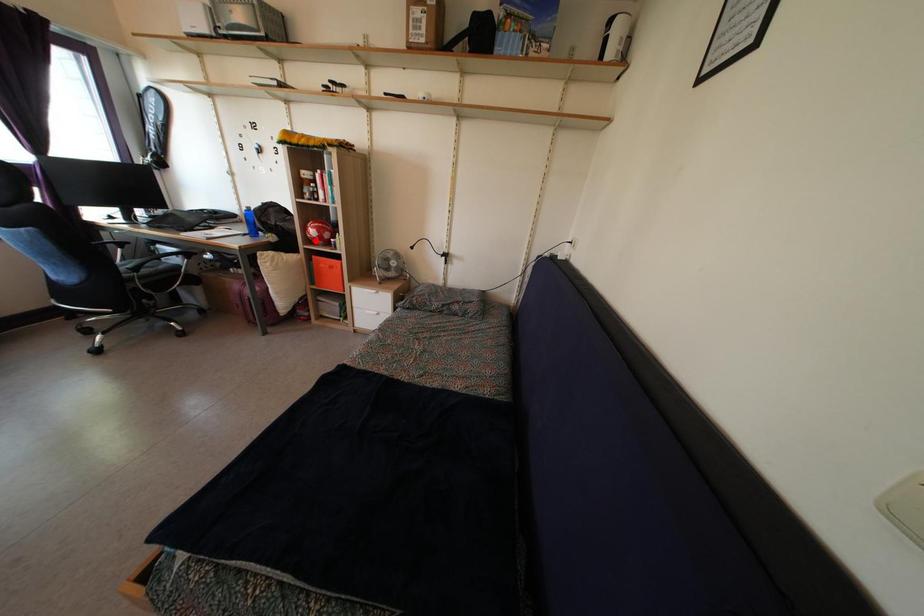
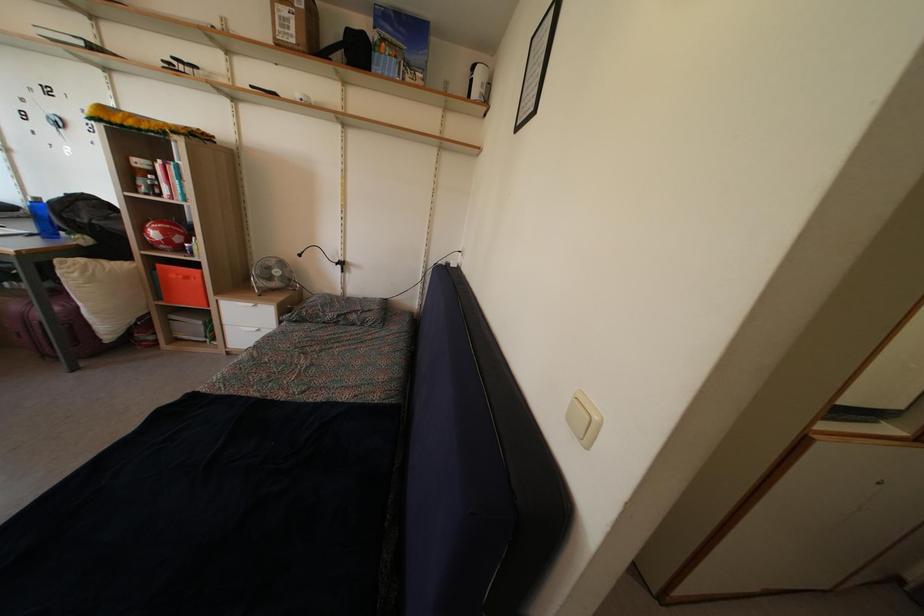
Question: I am providing you with two images of the same scene from different viewpoints. A red point is shown in image1. For the corresponding object point in image2, is it positioned nearer or farther from the camera?

Choices:
 (A) Nearer
 (B) Farther

Answer: (B)